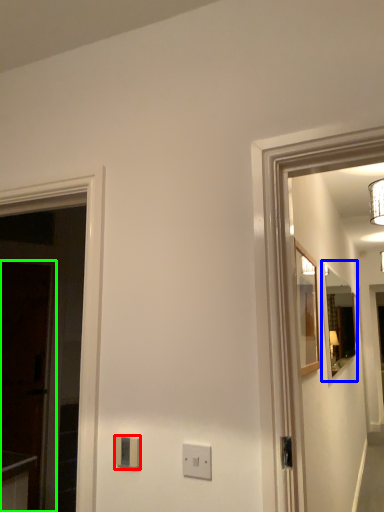
Question: Which object is positioned closest to light switch (highlighted by a red box)? Select from mirror (highlighted by a blue box) and glass door (highlighted by a green box).

Choices:
 (A) mirror
 (B) glass door

Answer: (B)